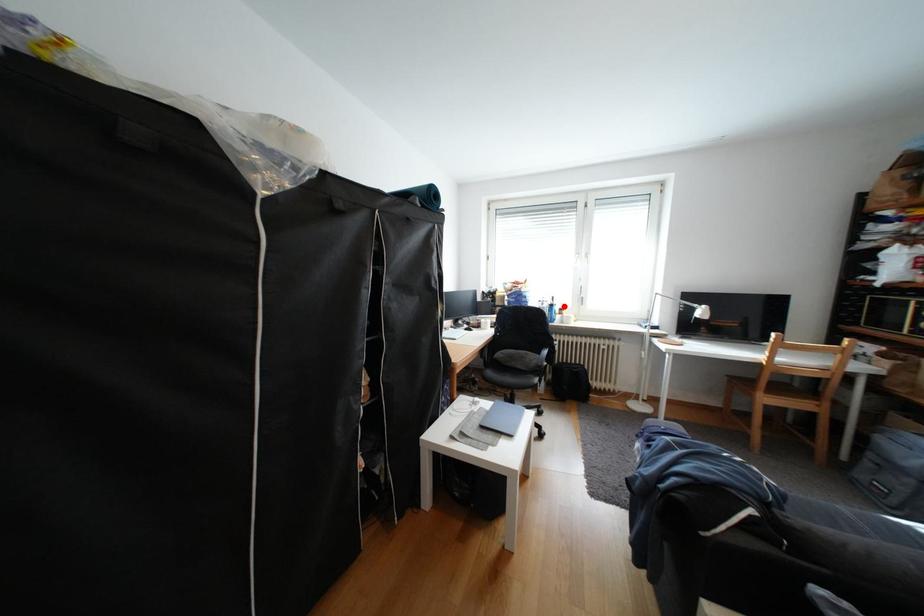
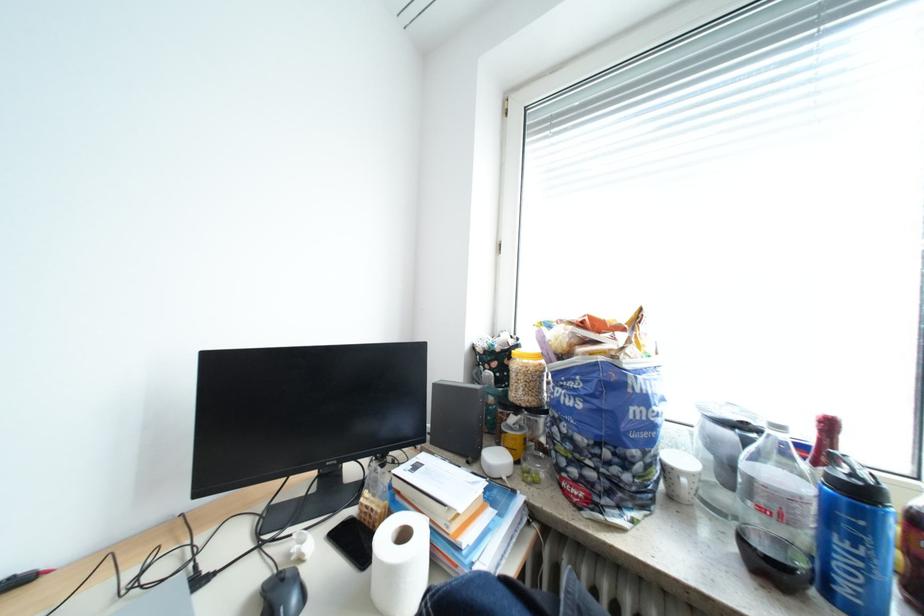
Question: I am providing you with two images of the same scene from different viewpoints. Given a red point in image1, look at the same physical point in image2. Is it:

Choices:
 (A) Closer to the viewpoint
 (B) Farther from the viewpoint

Answer: (A)